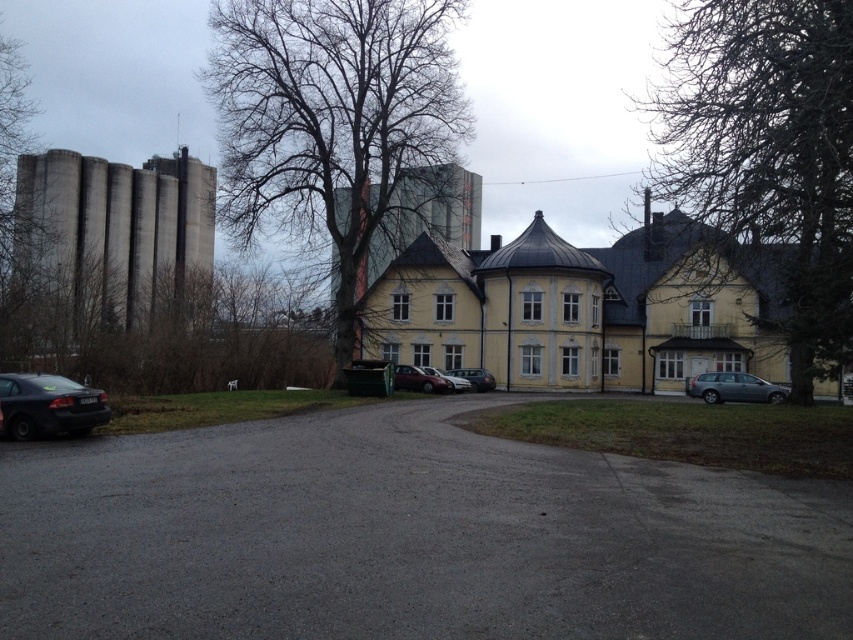
Where is `bare branches at center`? bare branches at center is located at coordinates (337, 128).

Is bare branches at center to the left of satin silver wagon at right from the viewer's perspective?

Yes, bare branches at center is to the left of satin silver wagon at right.

Is point (297, 61) closer to viewer compared to point (766, 384)?

That is False.

Find the location of `bare branches at center`. bare branches at center is located at coordinates (337, 128).

The height and width of the screenshot is (640, 853). I want to click on shiny red sedan at center, so click(x=418, y=380).

Is shiny red sedan at center closer to the viewer compared to satin silver car at center?

Yes.

Is point (398, 388) in front of point (465, 385)?

Yes, it is.

Where is `shiny red sedan at center`? shiny red sedan at center is located at coordinates (418, 380).

Is bare branches at upper center to the left of satin silver car at center from the viewer's perspective?

No, bare branches at upper center is not to the left of satin silver car at center.

Can you confirm if bare branches at upper center is shorter than satin silver car at center?

No, bare branches at upper center is not shorter than satin silver car at center.

Find the location of a particular element. Image resolution: width=853 pixels, height=640 pixels. bare branches at upper center is located at coordinates 766,157.